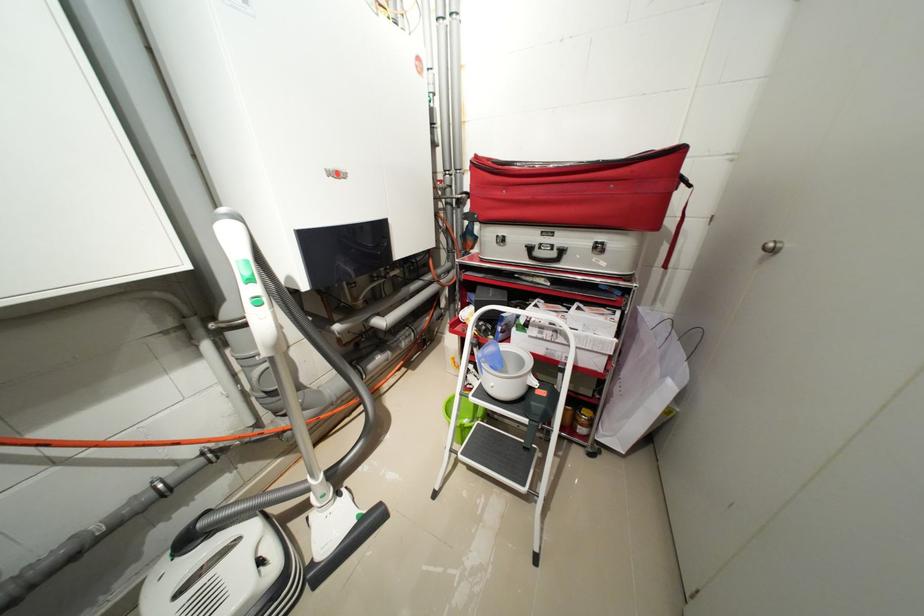
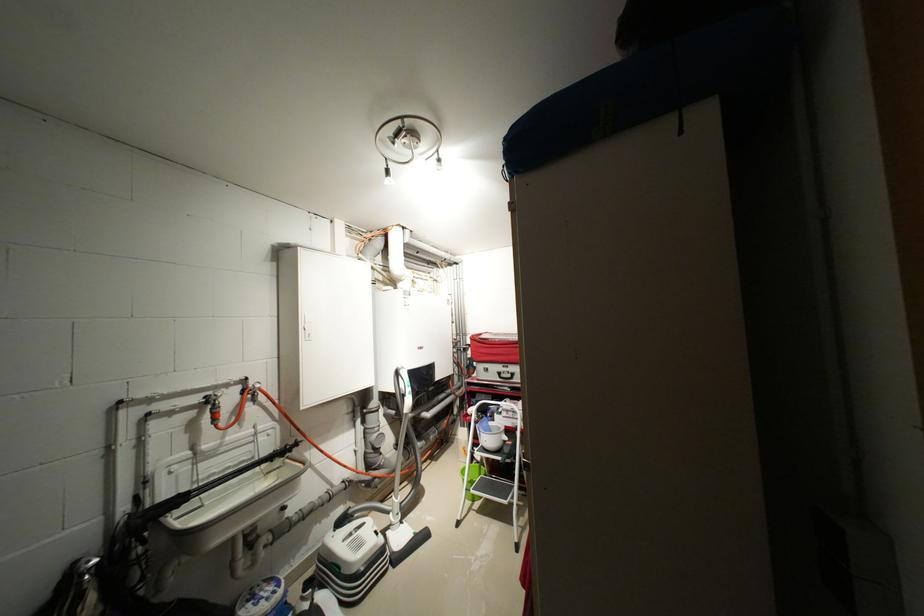
Where in the second image is the point corresponding to point 549,329 from the first image?

(515, 411)